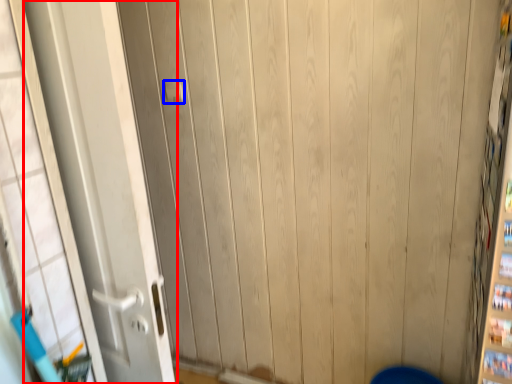
Question: Which point is further to the camera, door (highlighted by a red box) or door handle (highlighted by a blue box)?

Choices:
 (A) door
 (B) door handle

Answer: (B)